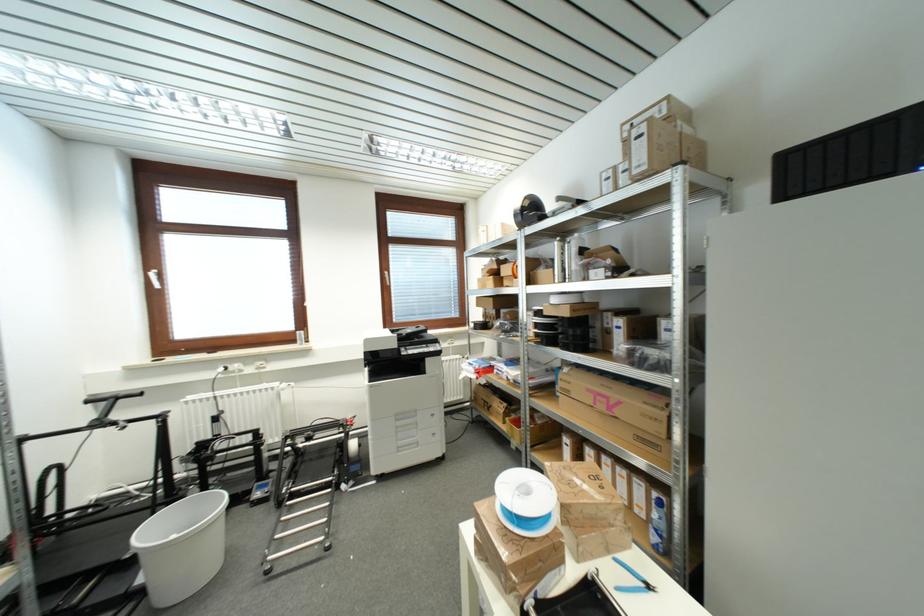
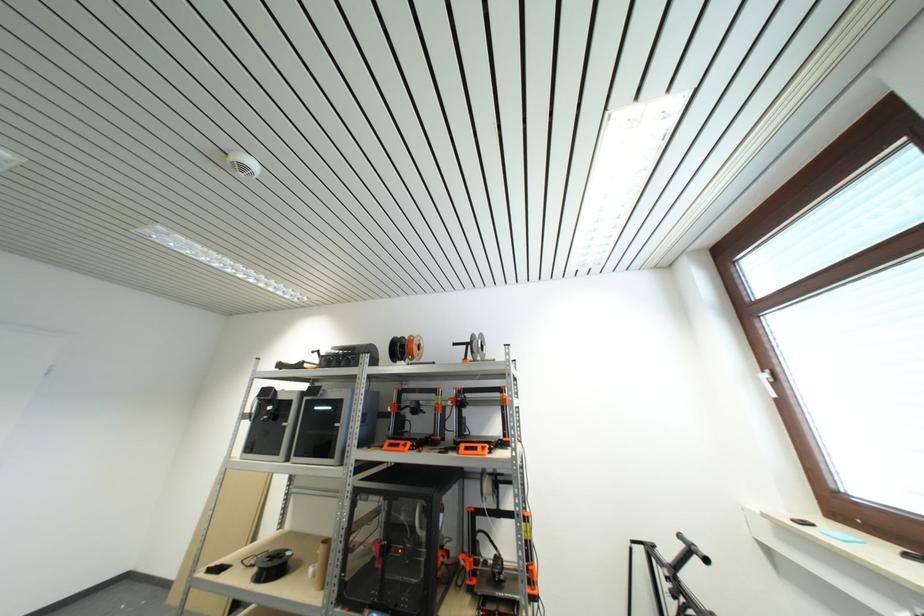
Find the pixel in the second image that matches point 92,403 in the first image.

(685, 540)